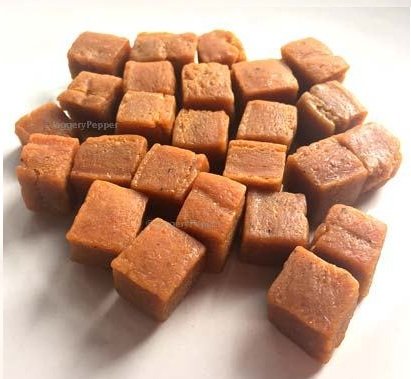
At what (x,y) coordinates should I click in order to perform the action: click on tabletop top right. Please return your answer as a coordinate pair (x, y). Image resolution: width=411 pixels, height=379 pixels. Looking at the image, I should click on (366, 37).